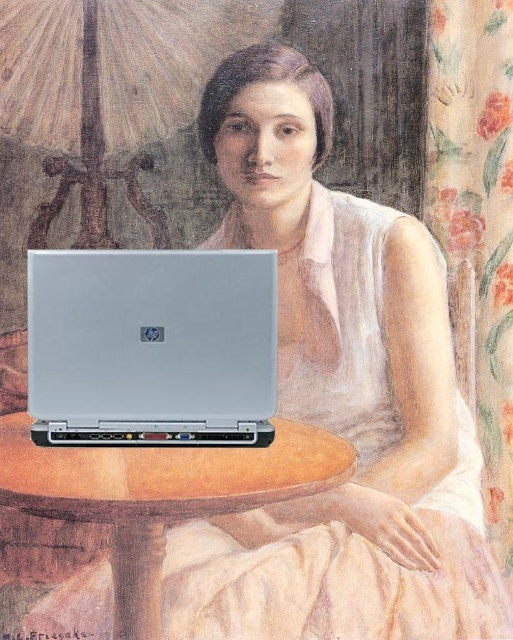
You are an interior designer assessing the placement of furniture in this digital artwork. The scene includes a matte silver laptop at center and a wooden round table at center. Which object is taller?

The matte silver laptop at center is taller than the wooden round table at center.